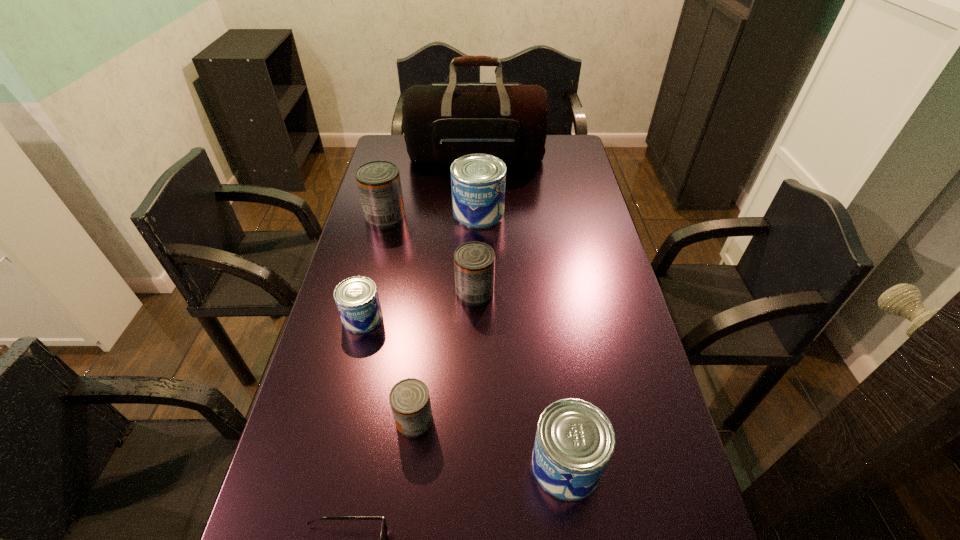
Locate an element on the screen. the fourth can from right to left is located at coordinates (409, 399).

Identify the location of the nearest red can. (409, 399).

Locate an element on the screen. The width and height of the screenshot is (960, 540). the smallest blue can is located at coordinates (357, 300).

What are the coordinates of `the leftmost blue can` in the screenshot? It's located at (357, 300).

Where is `free spot located 0.050m on the front pocket of the farthest object`? This screenshot has height=540, width=960. free spot located 0.050m on the front pocket of the farthest object is located at coordinates (476, 181).

The width and height of the screenshot is (960, 540). Find the location of `vacant space located 0.350m on the right of the farthest red can`. vacant space located 0.350m on the right of the farthest red can is located at coordinates (507, 217).

You are a GUI agent. You are given a task and a screenshot of the screen. Output one action in this format:
    pyautogui.click(x=<x>, y=<y>)
    Task: Click on the vacant space situated 0.090m on the front label of the biggest blue can
    
    Given the screenshot: What is the action you would take?
    pyautogui.click(x=530, y=212)

Where is `free space located 0.190m on the right of the rightmost red can`? free space located 0.190m on the right of the rightmost red can is located at coordinates (561, 292).

Where is `free space located on the front label of the second biggest blue can`? free space located on the front label of the second biggest blue can is located at coordinates (417, 464).

In order to click on vacant space located 0.270m on the front label of the second biggest blue can in this screenshot , I will do `click(402, 464)`.